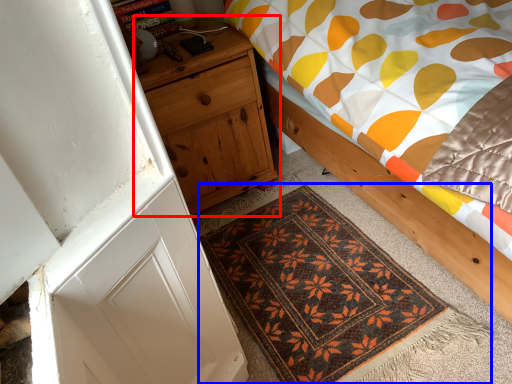
Question: Which object is further to the camera taking this photo, nightstand (highlighted by a red box) or mat (highlighted by a blue box)?

Choices:
 (A) nightstand
 (B) mat

Answer: (A)